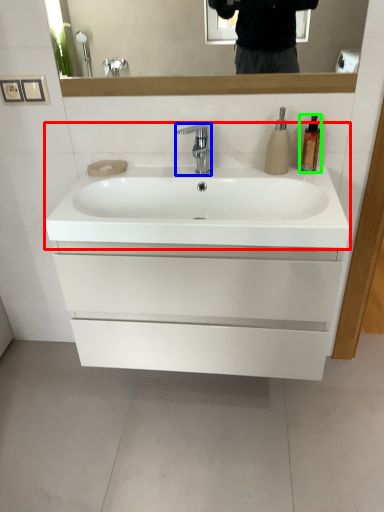
Question: Which object is the closest to the sink (highlighted by a red box)? Choose among these: tap (highlighted by a blue box) or soap dispenser (highlighted by a green box).

Choices:
 (A) tap
 (B) soap dispenser

Answer: (A)